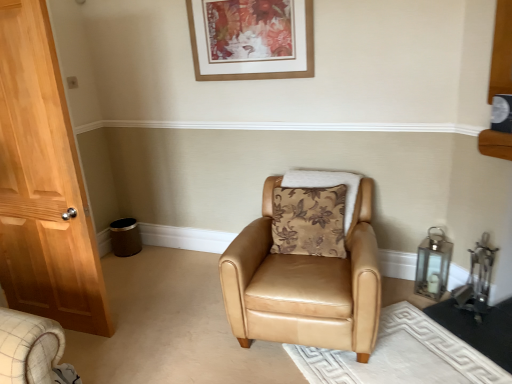
Question: Is brown floral fabric pillow at center taller or shorter than wooden picture frame at upper center?

Choices:
 (A) tall
 (B) short

Answer: (B)

Question: Is brown floral fabric pillow at center wider or thinner than wooden picture frame at upper center?

Choices:
 (A) wide
 (B) thin

Answer: (A)

Question: Considering the real-world distances, which object is closest to the wooden picture frame at upper center?

Choices:
 (A) tan leather armchair at center
 (B) brown floral fabric pillow at center

Answer: (B)

Question: Considering the real-world distances, which object is farthest from the tan leather armchair at center?

Choices:
 (A) wooden picture frame at upper center
 (B) brown floral fabric pillow at center

Answer: (A)